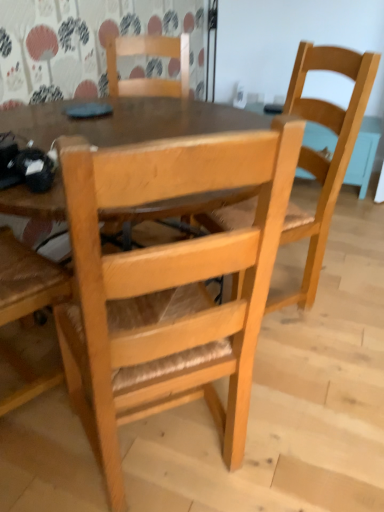
Question: Does natural wood chair at center, the first chair positioned from the front, have a greater width compared to natural wood chair at center, the 3th chair from the front?

Choices:
 (A) yes
 (B) no

Answer: (A)

Question: From a real-world perspective, is natural wood chair at center, which appears as the third chair when viewed from the back, on top of natural wood chair at center, the 3th chair from the front?

Choices:
 (A) no
 (B) yes

Answer: (A)

Question: Is natural wood chair at center, which appears as the third chair when viewed from the back, located outside natural wood chair at center, arranged as the first chair when viewed from the back?

Choices:
 (A) yes
 (B) no

Answer: (A)

Question: Can you confirm if natural wood chair at center, the first chair positioned from the front, is thinner than natural wood chair at center, arranged as the first chair when viewed from the back?

Choices:
 (A) no
 (B) yes

Answer: (A)

Question: Are natural wood chair at center, which appears as the third chair when viewed from the back, and natural wood chair at center, the 3th chair from the front, far apart?

Choices:
 (A) no
 (B) yes

Answer: (B)

Question: Is the depth of natural wood chair at center, which appears as the third chair when viewed from the back, less than that of natural wood chair at center, the 3th chair from the front?

Choices:
 (A) yes
 (B) no

Answer: (A)

Question: Can you confirm if natural wood chair at center, arranged as the first chair when viewed from the back, is thinner than natural wood chair at center, the first chair positioned from the front?

Choices:
 (A) no
 (B) yes

Answer: (B)

Question: Are natural wood chair at center, arranged as the first chair when viewed from the back, and natural wood chair at center, the first chair positioned from the front, making contact?

Choices:
 (A) yes
 (B) no

Answer: (B)

Question: Does natural wood chair at center, arranged as the first chair when viewed from the back, turn towards natural wood chair at center, which appears as the third chair when viewed from the back?

Choices:
 (A) yes
 (B) no

Answer: (A)

Question: Is natural wood chair at center, the 3th chair from the front, at the right side of natural wood chair at center, the first chair positioned from the front?

Choices:
 (A) no
 (B) yes

Answer: (A)

Question: From a real-world perspective, is natural wood chair at center, arranged as the first chair when viewed from the back, located beneath natural wood chair at center, which appears as the third chair when viewed from the back?

Choices:
 (A) no
 (B) yes

Answer: (A)

Question: Is the depth of natural wood chair at center, arranged as the first chair when viewed from the back, greater than that of natural wood chair at center, which appears as the third chair when viewed from the back?

Choices:
 (A) yes
 (B) no

Answer: (A)

Question: Can you confirm if natural wood chair at right, the 2th chair when ordered from front to back, is shorter than natural wood chair at center, the first chair positioned from the front?

Choices:
 (A) no
 (B) yes

Answer: (A)